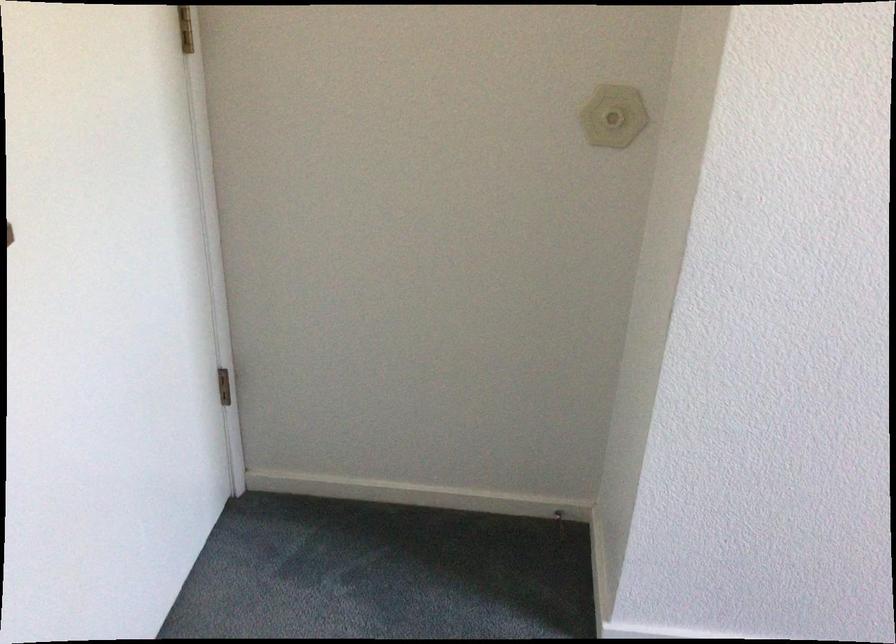
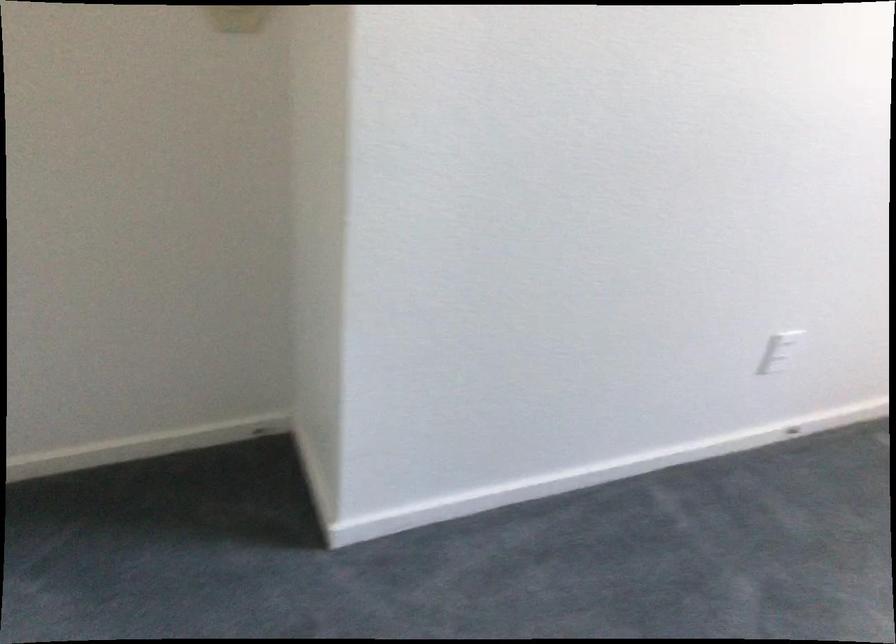
Question: The camera is either moving clockwise (left) or counter-clockwise (right) around the object. The first image is from the beginning of the video and the second image is from the end. Is the camera moving left or right when shooting the video?

Choices:
 (A) Left
 (B) Right

Answer: (A)